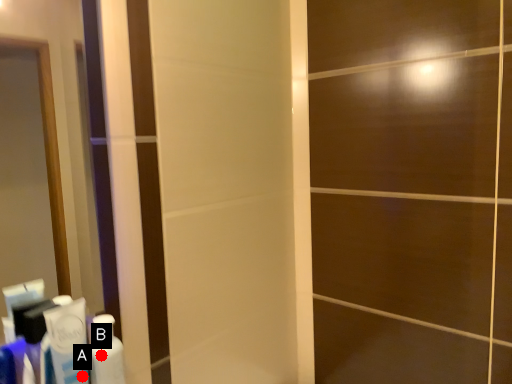
Question: Two points are circled on the image, labeled by A and B beside each circle. Which point is farther to the camera?

Choices:
 (A) A is further
 (B) B is further

Answer: (B)